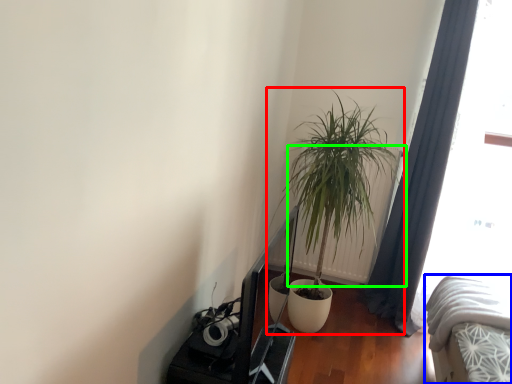
Question: Based on their relative distances, which object is nearer to houseplant (highlighted by a red box)? Choose from bed (highlighted by a blue box) and radiator (highlighted by a green box).

Choices:
 (A) bed
 (B) radiator

Answer: (B)